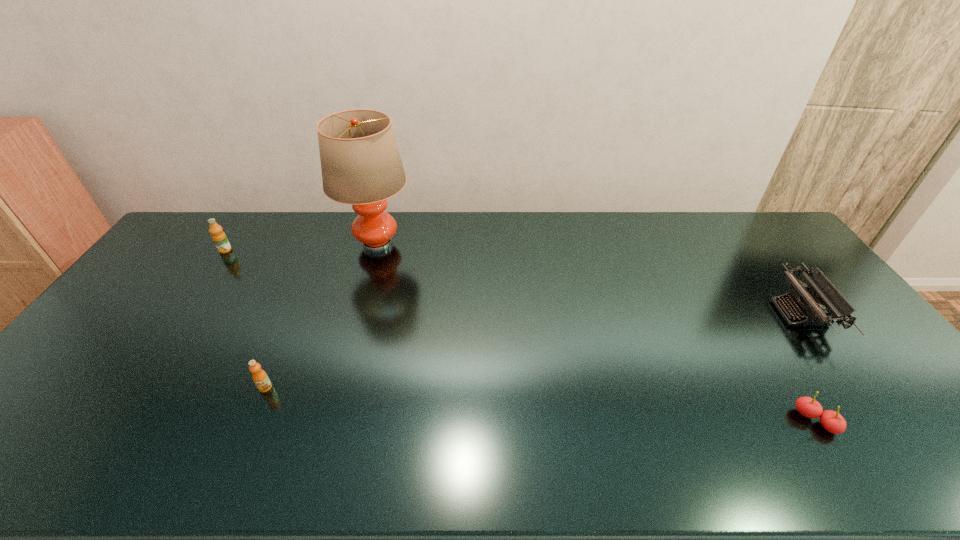
Identify the location of empty location between the taller orange juice and the cherry. (520, 335).

Identify the location of free space between the leftmost object and the shorter orange juice. (246, 319).

Find the location of a particular element. The width and height of the screenshot is (960, 540). free space between the tallest object and the third nearest object is located at coordinates (588, 278).

Where is `blank region between the fourth shortest object and the cherry`? blank region between the fourth shortest object and the cherry is located at coordinates (520, 335).

Where is `empty location between the second tallest object and the typewriter`? The image size is (960, 540). empty location between the second tallest object and the typewriter is located at coordinates (513, 282).

Find the location of a particular element. object that is the closest one to the third object from left to right is located at coordinates (219, 238).

Where is `the third closest object to the typewriter`? The height and width of the screenshot is (540, 960). the third closest object to the typewriter is located at coordinates (259, 376).

This screenshot has width=960, height=540. Find the location of `free space that satisfies the following two spatial constraints: 1. on the front label of the second nearest object; 2. on the right side of the shortest object`. free space that satisfies the following two spatial constraints: 1. on the front label of the second nearest object; 2. on the right side of the shortest object is located at coordinates (252, 421).

This screenshot has width=960, height=540. I want to click on free spot that satisfies the following two spatial constraints: 1. on the typing side of the third nearest object; 2. on the front label of the second nearest object, so click(x=854, y=387).

In order to click on free space that satisfies the following two spatial constraints: 1. on the typing side of the third nearest object; 2. on the front label of the shorter orange juice in this screenshot , I will do `click(854, 387)`.